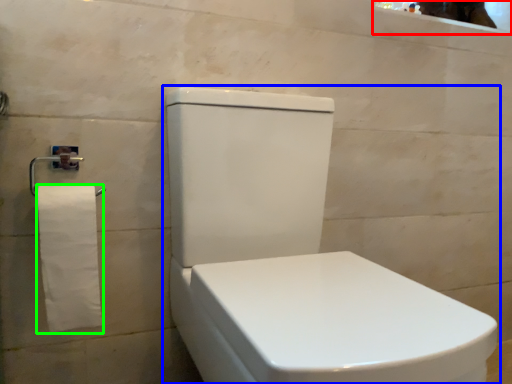
Question: Which object is positioned farthest from mirror (highlighted by a red box)? Select from toilet (highlighted by a blue box) and toilet paper (highlighted by a green box).

Choices:
 (A) toilet
 (B) toilet paper

Answer: (B)